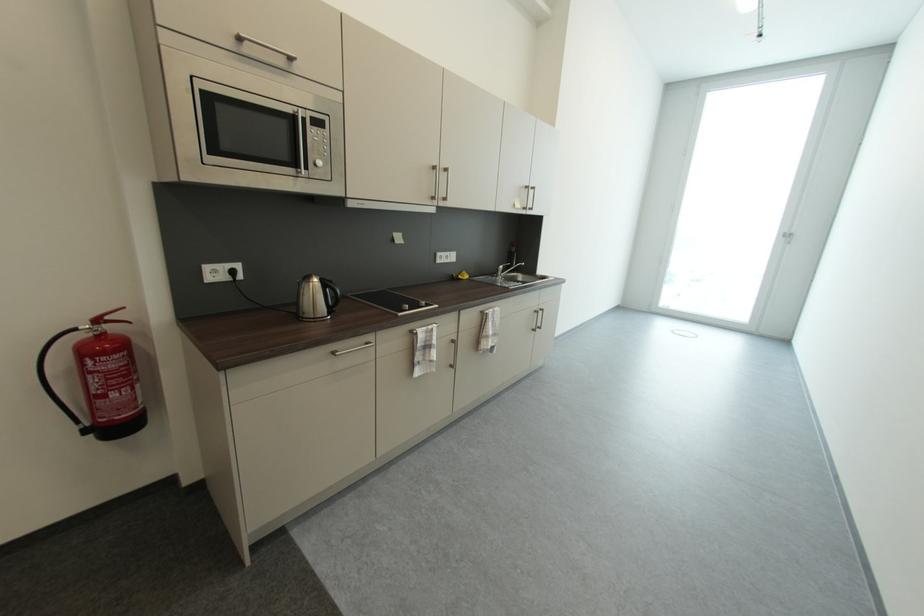
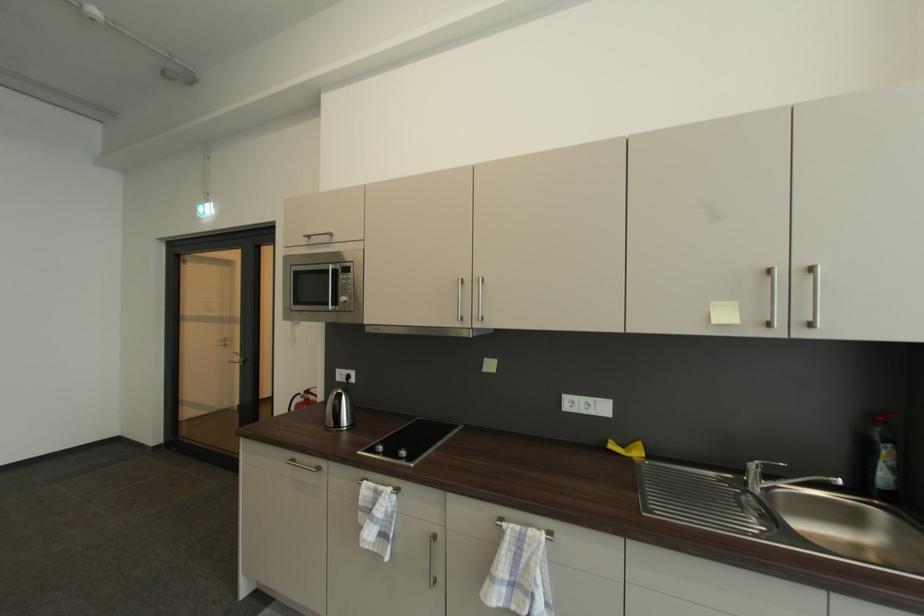
The point at (502,309) is marked in the first image. Where is the corresponding point in the second image?

(545, 531)